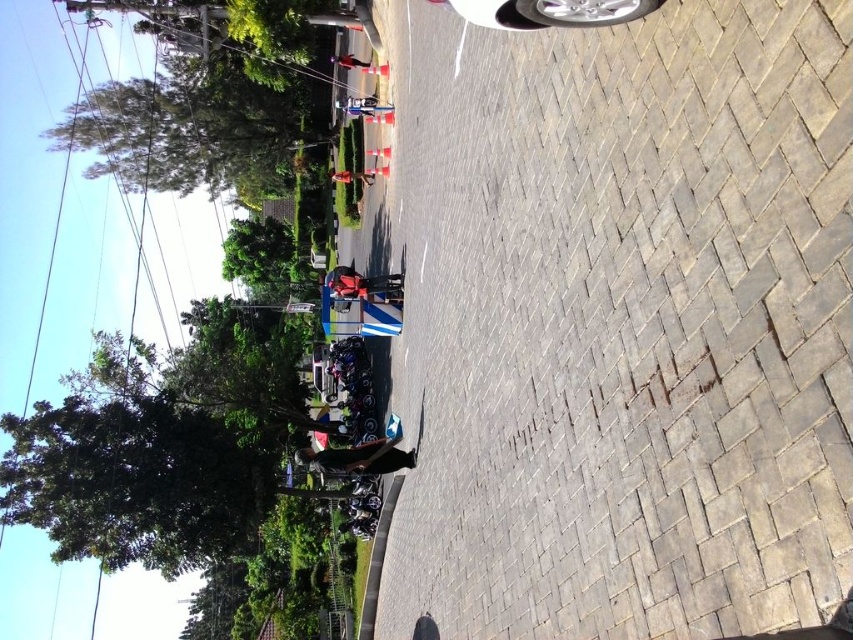
You are a delivery person who needs to load a large package into the silver metallic car at upper center and the dark brown leather jacket at lower center. Which object is taller and can accommodate the package?

The silver metallic car at upper center is much taller than the dark brown leather jacket at lower center, so the package can be placed in the car.